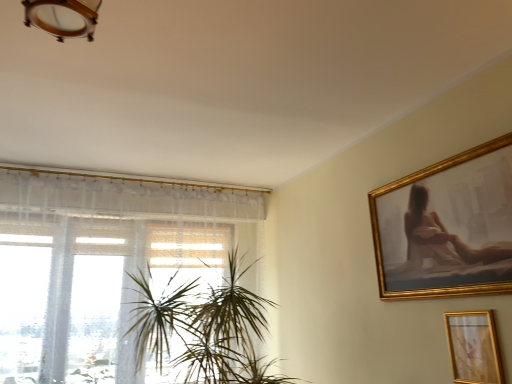
Question: Do you think green leafy plant at center is within gold metallic picture frame at lower right, or outside of it?

Choices:
 (A) inside
 (B) outside

Answer: (B)

Question: From a real-world perspective, relative to gold metallic picture frame at lower right, is green leafy plant at center vertically above or below?

Choices:
 (A) below
 (B) above

Answer: (B)

Question: Which is farther from the green leafy plant at center?

Choices:
 (A) gold metallic picture frame at lower right
 (B) white sheer curtain at left

Answer: (A)

Question: Which is nearer to the gold metallic picture frame at lower right?

Choices:
 (A) white sheer curtain at left
 (B) green leafy plant at center

Answer: (B)